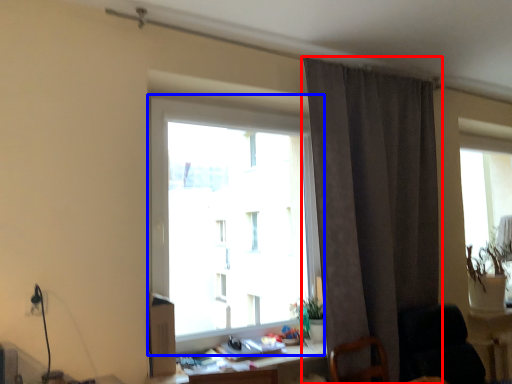
Question: Which object is closer to the camera taking this photo, curtain (highlighted by a red box) or window (highlighted by a blue box)?

Choices:
 (A) curtain
 (B) window

Answer: (B)